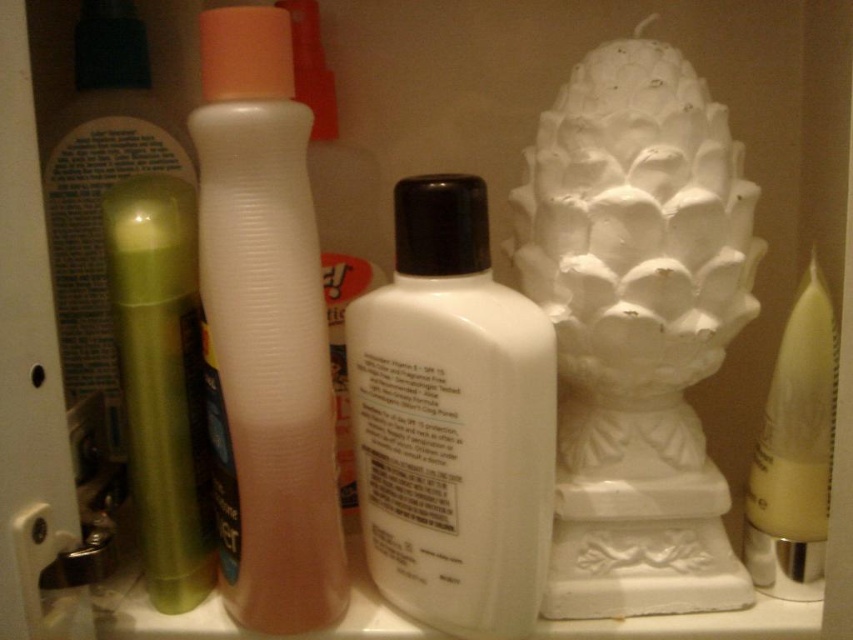
Question: Which of these objects is positioned closest to the green matte tube at left?

Choices:
 (A) white ceramic sculpture at center right
 (B) translucent plastic bottle at center

Answer: (B)

Question: Can you confirm if green matte tube at left is bigger than yellow matte candle at right?

Choices:
 (A) no
 (B) yes

Answer: (B)

Question: Which object is closer to the camera taking this photo?

Choices:
 (A) translucent plastic lotion at center
 (B) yellow matte candle at right
 (C) green matte tube at left
 (D) white matte lotion at center

Answer: (A)

Question: Is translucent plastic lotion at center positioned at the back of yellow matte candle at right?

Choices:
 (A) no
 (B) yes

Answer: (A)

Question: Which is farther from the translucent plastic bottle at center?

Choices:
 (A) green matte tube at left
 (B) white matte lotion at center
 (C) translucent plastic lotion at center

Answer: (A)

Question: Is translucent plastic lotion at center to the right of translucent plastic bottle at center from the viewer's perspective?

Choices:
 (A) yes
 (B) no

Answer: (B)